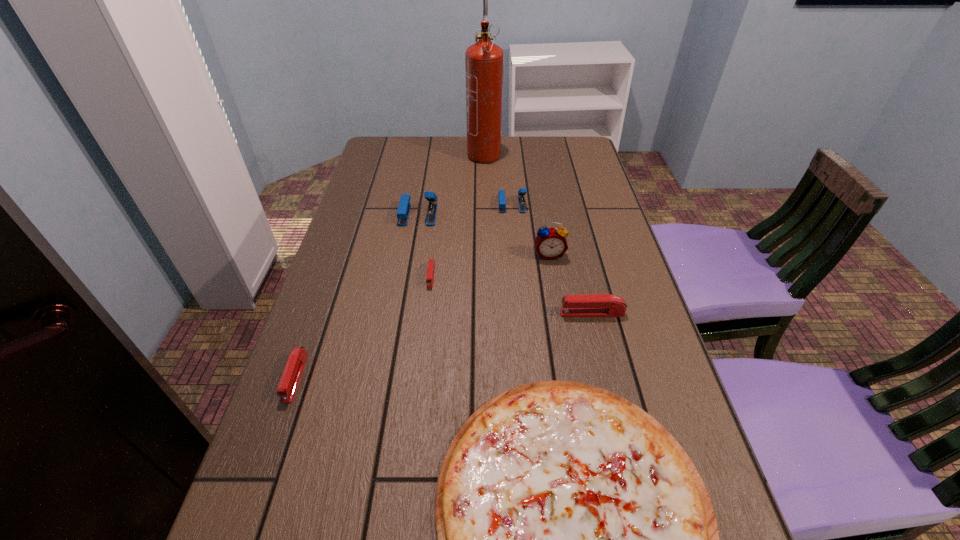
Identify the location of empty space between the leftmost red stapler and the smallest red stapler. This screenshot has height=540, width=960. (364, 327).

Find the location of a particular element. The width and height of the screenshot is (960, 540). free spot between the tallest stapler and the fourth farthest object is located at coordinates (484, 234).

You are a GUI agent. You are given a task and a screenshot of the screen. Output one action in this format:
    pyautogui.click(x=<x>, y=<y>)
    Task: Click on the free space between the seventh tallest object and the tallest stapler
    This screenshot has height=540, width=960.
    Given the screenshot: What is the action you would take?
    pyautogui.click(x=424, y=245)

Where is `unoccupied position between the tallest stapler and the tallest object`? unoccupied position between the tallest stapler and the tallest object is located at coordinates (451, 183).

Where is `free spot between the third shortest object and the right blue stapler`? The height and width of the screenshot is (540, 960). free spot between the third shortest object and the right blue stapler is located at coordinates (404, 291).

Where is `unoccupied position between the fourth farthest object and the smaller blue stapler`? unoccupied position between the fourth farthest object and the smaller blue stapler is located at coordinates (531, 230).

At what (x,y) coordinates should I click in order to perform the action: click on unoccupied position between the fourth farthest stapler and the third shortest object. Please return your answer as a coordinate pair (x, y). Looking at the image, I should click on (444, 346).

This screenshot has height=540, width=960. I want to click on object that is the seventh nearest to the second smallest red stapler, so click(x=484, y=61).

I want to click on the sixth closest object to the third tallest object, so click(x=294, y=367).

This screenshot has height=540, width=960. I want to click on stapler that is the second closest one to the second nearest red stapler, so (x=522, y=191).